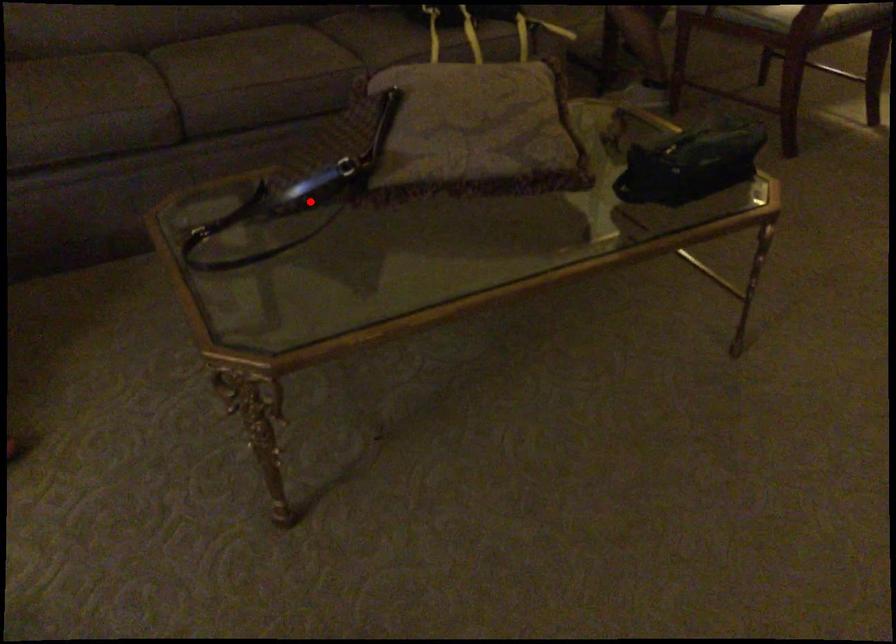
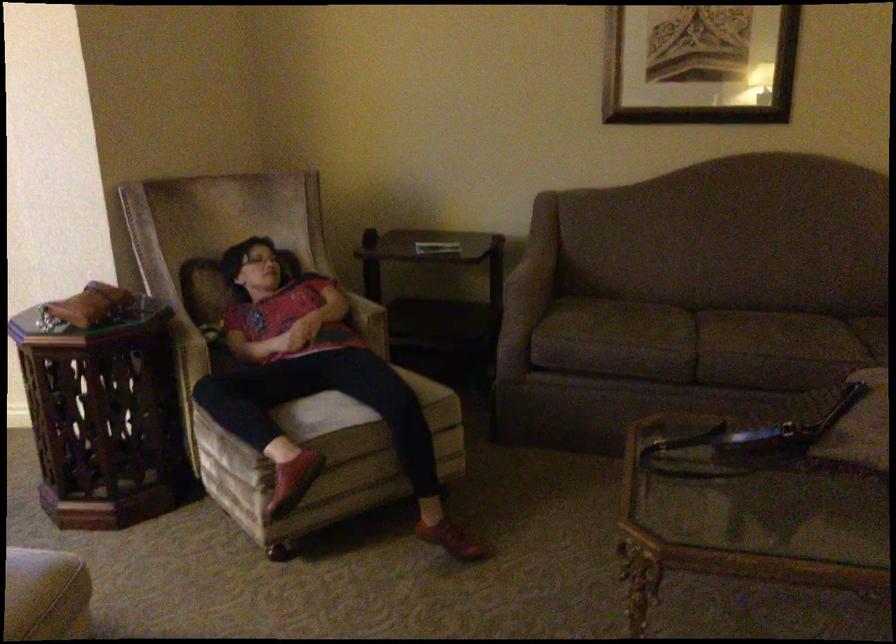
Locate, in the second image, the point that corresponds to the highlighted location in the first image.

(761, 447)